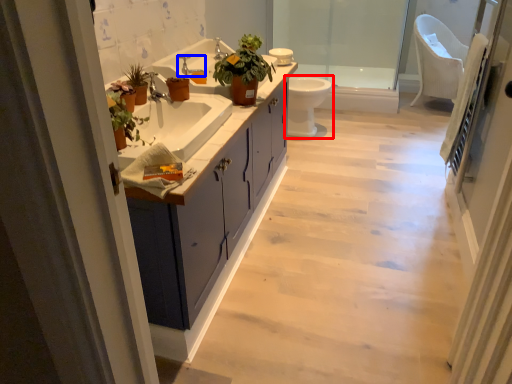
Question: Which point is closer to the camera, toilet (highlighted by a red box) or tap (highlighted by a blue box)?

Choices:
 (A) toilet
 (B) tap

Answer: (B)